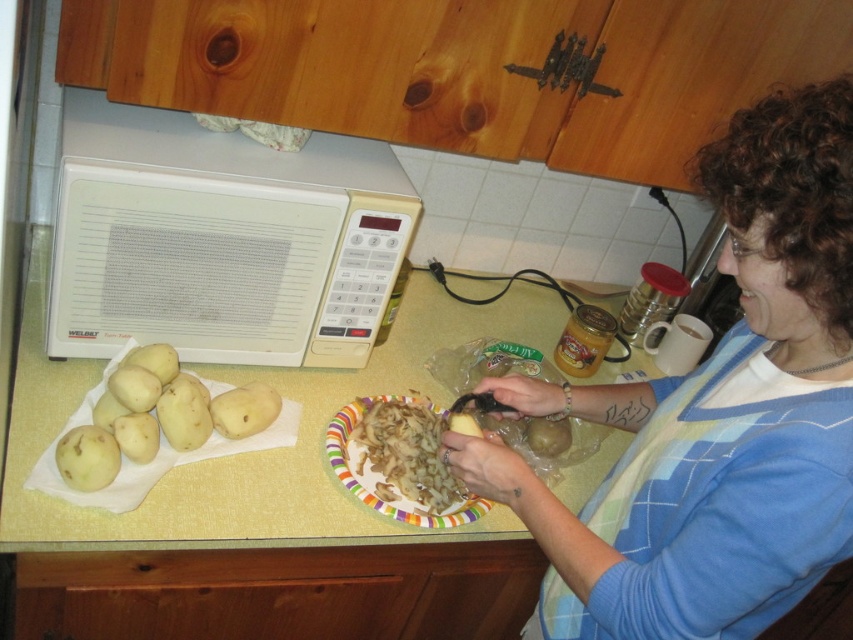
Question: Does blue knit sweater at upper right have a lesser width compared to white plastic microwave at upper left?

Choices:
 (A) yes
 (B) no

Answer: (A)

Question: Which point is closer to the camera?

Choices:
 (A) (169, 193)
 (B) (100, 468)

Answer: (B)

Question: From the image, what is the correct spatial relationship of yellow laminate counter at center in relation to smooth yellow potato at lower left?

Choices:
 (A) above
 (B) below

Answer: (A)

Question: Estimate the real-world distances between objects in this image. Which object is farther from the yellow matte potato at center-left?

Choices:
 (A) white plastic microwave at upper left
 (B) smooth yellow potato at lower left
 (C) blue knit sweater at upper right

Answer: (C)

Question: Which point is closer to the camera?

Choices:
 (A) (454, 477)
 (B) (48, 253)
 (C) (770, 289)

Answer: (C)

Question: Does yellow laminate counter at center appear on the left side of white glossy plate at center?

Choices:
 (A) yes
 (B) no

Answer: (A)